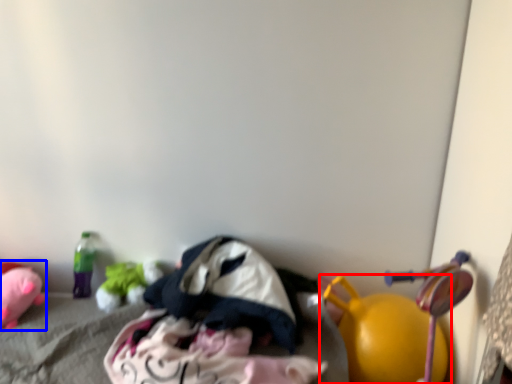
Question: Which of the following is the farthest to the observer, toy (highlighted by a red box) or toy (highlighted by a blue box)?

Choices:
 (A) toy
 (B) toy

Answer: (B)